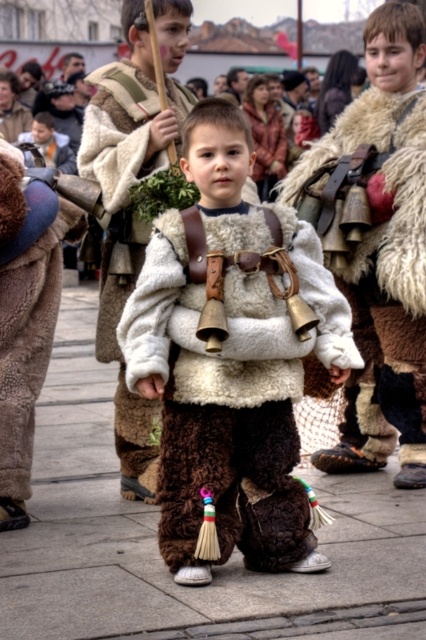
Based on the scene description, which object, the brown fur pants at center or the fuzzy white vest at center, has a greater height?

The fuzzy white vest at center is taller than the brown fur pants at center according to the description.

You are a photographer at the event and need to adjust the lighting so that both the brown fur pants at center and the fuzzy white vest at center are equally visible. Since one is larger than the other, which object should you focus on more to ensure proper exposure?

The brown fur pants at center is bigger than the fuzzy white vest at center, so you should focus more on the brown fur pants at center to ensure proper exposure.

You are a photographer at the event and want to capture a photo where both the fuzzy brown pants at center and the fuzzy white vest at center are clearly visible. Based on their sizes, which one might require you to adjust your camera angle to ensure it doesn

The fuzzy brown pants at center is shorter than the fuzzy white vest at center, so you might need to adjust your camera angle to ensure the fuzzy brown pants at center is in focus and visible alongside the taller fuzzy white vest at center.